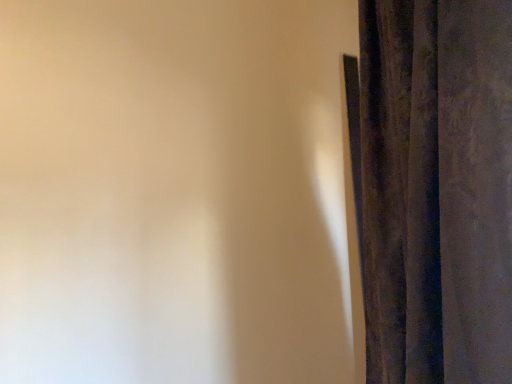
Describe the element at coordinates (434, 188) in the screenshot. The image size is (512, 384). I see `velvet dark blue curtain at right` at that location.

Locate an element on the screen. Image resolution: width=512 pixels, height=384 pixels. velvet dark blue curtain at right is located at coordinates (434, 188).

In order to face velvet dark blue curtain at right, should I rotate leftwards or rightwards?

You should look right and rotate roughly 22.222 degrees.

Where is `velvet dark blue curtain at right`? The image size is (512, 384). velvet dark blue curtain at right is located at coordinates (434, 188).